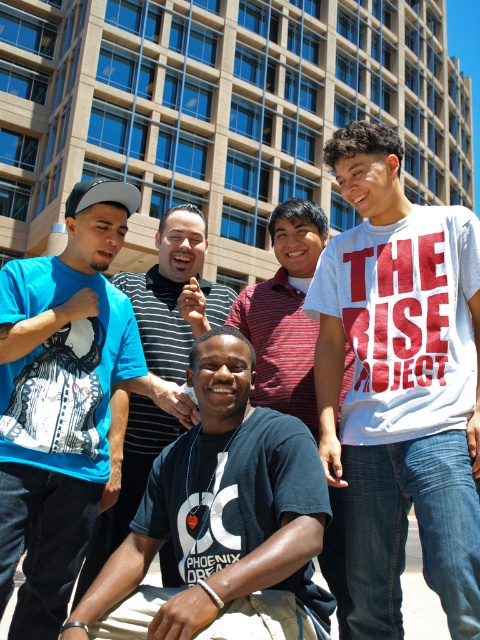
Who is positioned more to the left, black cotton t-shirt at center or white cotton shirt at upper right?

Positioned to the left is black cotton t-shirt at center.

Is black cotton t-shirt at center to the right of white cotton shirt at upper right from the viewer's perspective?

Incorrect, black cotton t-shirt at center is not on the right side of white cotton shirt at upper right.

Image resolution: width=480 pixels, height=640 pixels. I want to click on black cotton t-shirt at center, so click(x=220, y=522).

Consider the image. Can you confirm if black cotton t-shirt at center is thinner than matte black t-shirt at left?

No.

Does black cotton t-shirt at center have a smaller size compared to matte black t-shirt at left?

No.

Who is more distant from viewer, (298, 532) or (171, 276)?

Positioned behind is point (171, 276).

Where is `black cotton t-shirt at center`? black cotton t-shirt at center is located at coordinates (220, 522).

Between white cotton t-shirt at right and matte black t-shirt at left, which one is positioned lower?

matte black t-shirt at left is below.

Can you confirm if white cotton t-shirt at right is positioned below matte black t-shirt at left?

Incorrect, white cotton t-shirt at right is not positioned below matte black t-shirt at left.

At what (x,y) coordinates should I click in order to perform the action: click on white cotton t-shirt at right. Please return your answer as a coordinate pair (x, y). The height and width of the screenshot is (640, 480). Looking at the image, I should click on (399, 385).